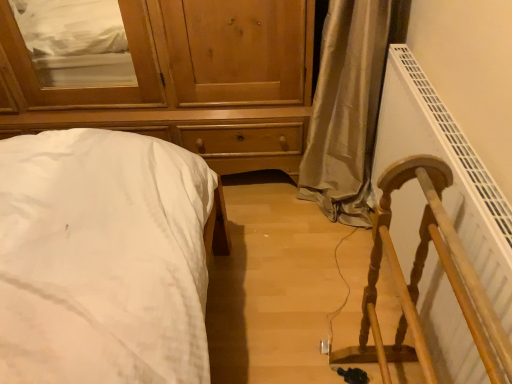
Question: Does white plastic radiator at right have a lesser height compared to white cotton bed at left?

Choices:
 (A) yes
 (B) no

Answer: (B)

Question: Does white plastic radiator at right have a greater width compared to white cotton bed at left?

Choices:
 (A) no
 (B) yes

Answer: (A)

Question: From the image's perspective, is white plastic radiator at right under white cotton bed at left?

Choices:
 (A) yes
 (B) no

Answer: (B)

Question: From a real-world perspective, is white plastic radiator at right under white cotton bed at left?

Choices:
 (A) no
 (B) yes

Answer: (A)

Question: Is white plastic radiator at right looking in the opposite direction of white cotton bed at left?

Choices:
 (A) no
 (B) yes

Answer: (A)

Question: From a real-world perspective, is white plastic radiator at right physically located above or below wooden chest of drawers at upper left?

Choices:
 (A) below
 (B) above

Answer: (A)

Question: Looking at the image, does white plastic radiator at right seem bigger or smaller compared to wooden chest of drawers at upper left?

Choices:
 (A) small
 (B) big

Answer: (A)

Question: Is white plastic radiator at right to the left or to the right of wooden chest of drawers at upper left in the image?

Choices:
 (A) left
 (B) right

Answer: (B)

Question: Which is correct: white plastic radiator at right is inside wooden chest of drawers at upper left, or outside of it?

Choices:
 (A) outside
 (B) inside

Answer: (A)

Question: In terms of height, does wooden chest of drawers at upper left look taller or shorter compared to white cotton bed at left?

Choices:
 (A) short
 (B) tall

Answer: (B)

Question: Is wooden chest of drawers at upper left wider or thinner than white cotton bed at left?

Choices:
 (A) wide
 (B) thin

Answer: (B)

Question: In the image, is wooden chest of drawers at upper left positioned in front of or behind white cotton bed at left?

Choices:
 (A) behind
 (B) front

Answer: (A)

Question: Which is correct: wooden chest of drawers at upper left is inside white cotton bed at left, or outside of it?

Choices:
 (A) inside
 (B) outside

Answer: (B)

Question: Considering their positions, is white cotton bed at left located in front of or behind wooden chest of drawers at upper left?

Choices:
 (A) behind
 (B) front

Answer: (B)

Question: Considering the positions of white cotton bed at left and wooden chest of drawers at upper left in the image, is white cotton bed at left taller or shorter than wooden chest of drawers at upper left?

Choices:
 (A) tall
 (B) short

Answer: (B)